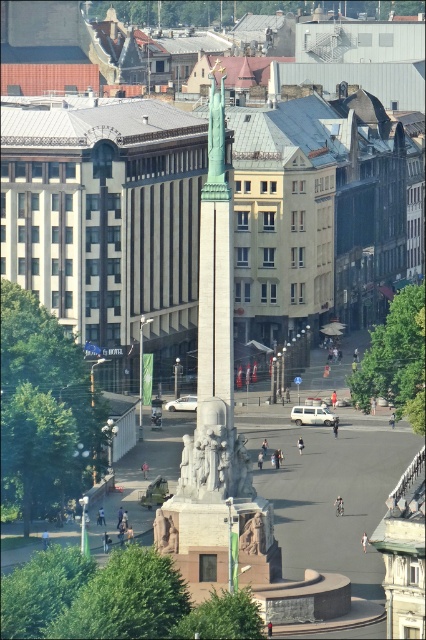
Question: Which of the following is the closest to the observer?

Choices:
 (A) rustic stone statue at center
 (B) polished stone obelisk at center

Answer: (B)

Question: Is polished stone obelisk at center bigger than rustic stone statue at center?

Choices:
 (A) yes
 (B) no

Answer: (A)

Question: Does polished stone obelisk at center appear on the right side of rustic stone statue at center?

Choices:
 (A) yes
 (B) no

Answer: (B)

Question: Which object is closer to the camera taking this photo?

Choices:
 (A) rustic stone statue at center
 (B) polished stone obelisk at center

Answer: (B)

Question: From the image, what is the correct spatial relationship of polished stone obelisk at center in relation to rustic stone statue at center?

Choices:
 (A) above
 (B) below

Answer: (A)